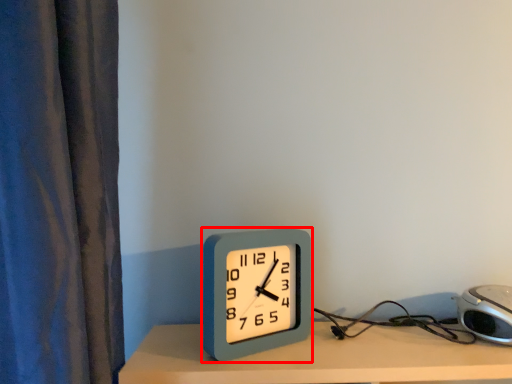
Question: From the image's perspective, where is alarm clock (annotated by the red box) located relative to alarm clock?

Choices:
 (A) above
 (B) below

Answer: (A)